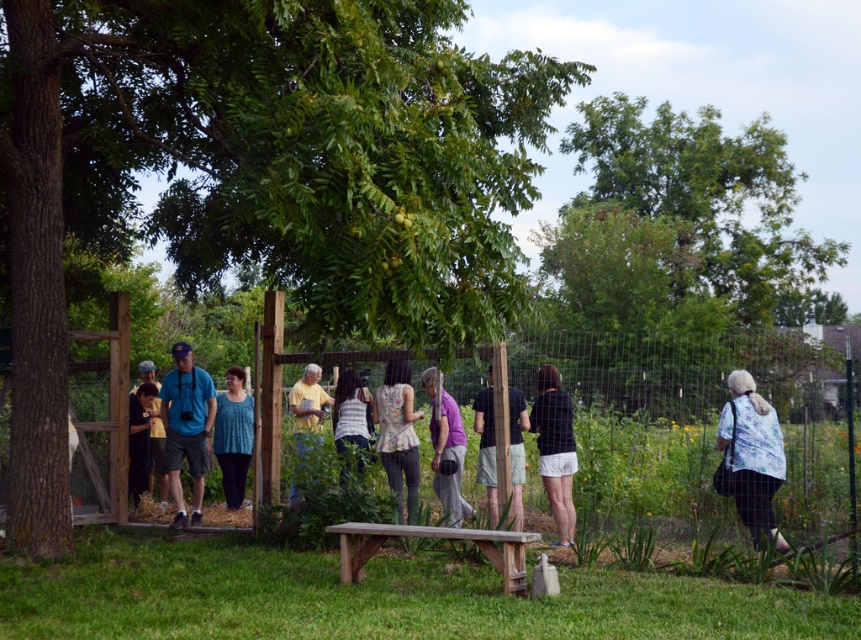
Based on the photo, you are a photographer positioned at the edge of the garden. You notice two people wearing the white floral shirt at lower right and the teal knitted top at center. Which person is standing closer to the wooden gazebo in the center?

The white floral shirt at lower right is located above the teal knitted top at center, meaning it is closer to the wooden gazebo in the center.

You are a photographer trying to capture a clear shot of the matte black shirt at center and the green leafy tree at upper center. However, the tree is blocking your view of the shirt. Can you adjust your position to see both objects without any obstruction?

The matte black shirt at center is behind the green leafy tree at upper center, so moving your position to either side of the tree might allow you to see both objects without obstruction.